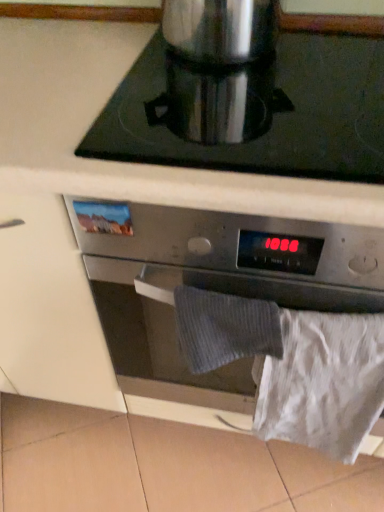
Question: Is silver metallic pot at upper center completely or partially inside satin silver oven at center?

Choices:
 (A) no
 (B) yes

Answer: (B)

Question: Is satin silver oven at center thinner than silver metallic pot at upper center?

Choices:
 (A) yes
 (B) no

Answer: (B)

Question: Is satin silver oven at center not inside silver metallic pot at upper center?

Choices:
 (A) no
 (B) yes

Answer: (B)

Question: Can you confirm if satin silver oven at center is taller than silver metallic pot at upper center?

Choices:
 (A) yes
 (B) no

Answer: (A)

Question: Is satin silver oven at center wider than silver metallic pot at upper center?

Choices:
 (A) yes
 (B) no

Answer: (A)

Question: Which is correct: white paper at lower right is inside satin silver oven at center, or outside of it?

Choices:
 (A) inside
 (B) outside

Answer: (B)

Question: In terms of size, does white paper at lower right appear bigger or smaller than satin silver oven at center?

Choices:
 (A) small
 (B) big

Answer: (A)

Question: Relative to satin silver oven at center, is white paper at lower right in front or behind?

Choices:
 (A) front
 (B) behind

Answer: (B)

Question: Considering the positions of white paper at lower right and satin silver oven at center in the image, is white paper at lower right taller or shorter than satin silver oven at center?

Choices:
 (A) tall
 (B) short

Answer: (B)

Question: From the image's perspective, is satin silver oven at center above or below silver metallic pot at upper center?

Choices:
 (A) below
 (B) above

Answer: (A)

Question: Is satin silver oven at center bigger or smaller than silver metallic pot at upper center?

Choices:
 (A) small
 (B) big

Answer: (B)

Question: From their relative heights in the image, would you say satin silver oven at center is taller or shorter than silver metallic pot at upper center?

Choices:
 (A) short
 (B) tall

Answer: (B)

Question: Is satin silver oven at center to the left or to the right of silver metallic pot at upper center in the image?

Choices:
 (A) right
 (B) left

Answer: (A)

Question: Considering the positions of satin silver coffee pot at upper center and silver metallic pot at upper center in the image, is satin silver coffee pot at upper center wider or thinner than silver metallic pot at upper center?

Choices:
 (A) wide
 (B) thin

Answer: (B)

Question: Is satin silver coffee pot at upper center bigger or smaller than silver metallic pot at upper center?

Choices:
 (A) big
 (B) small

Answer: (B)